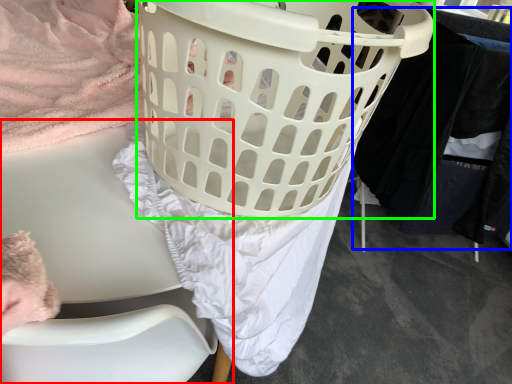
Question: Which is nearer to the furniture (highlighted by a red box)? clothing (highlighted by a blue box) or basket (highlighted by a green box).

Choices:
 (A) clothing
 (B) basket

Answer: (B)